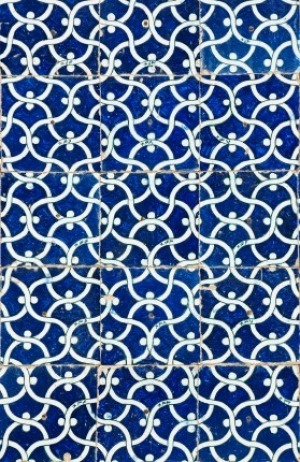
The width and height of the screenshot is (300, 462). Identify the location of bottom left tile. (39, 429).